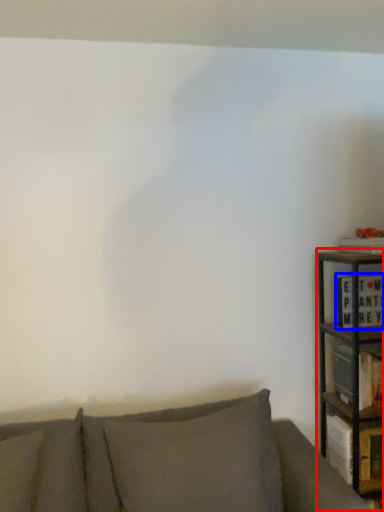
Question: Which object is closer to the camera taking this photo, bookcase (highlighted by a red box) or book (highlighted by a blue box)?

Choices:
 (A) bookcase
 (B) book

Answer: (A)